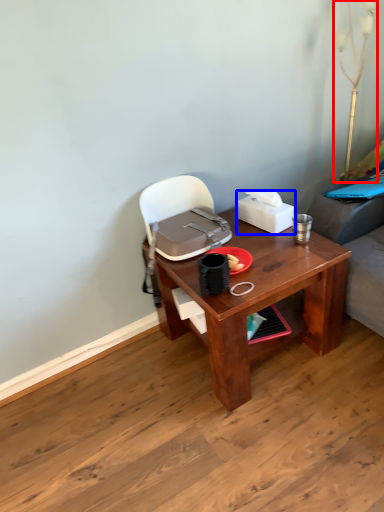
Question: Among these objects, which one is nearest to the camera, table lamp (highlighted by a red box) or box (highlighted by a blue box)?

Choices:
 (A) table lamp
 (B) box

Answer: (A)